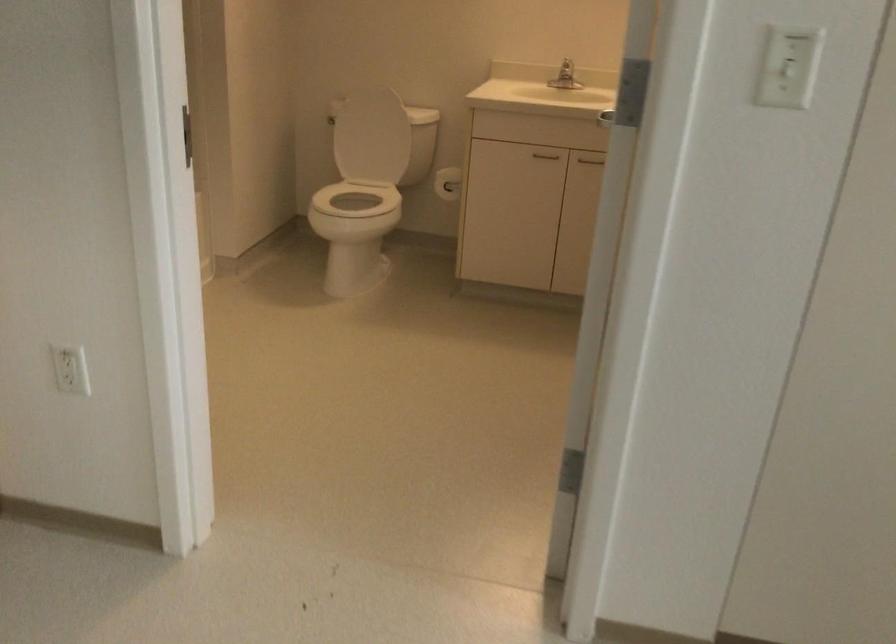
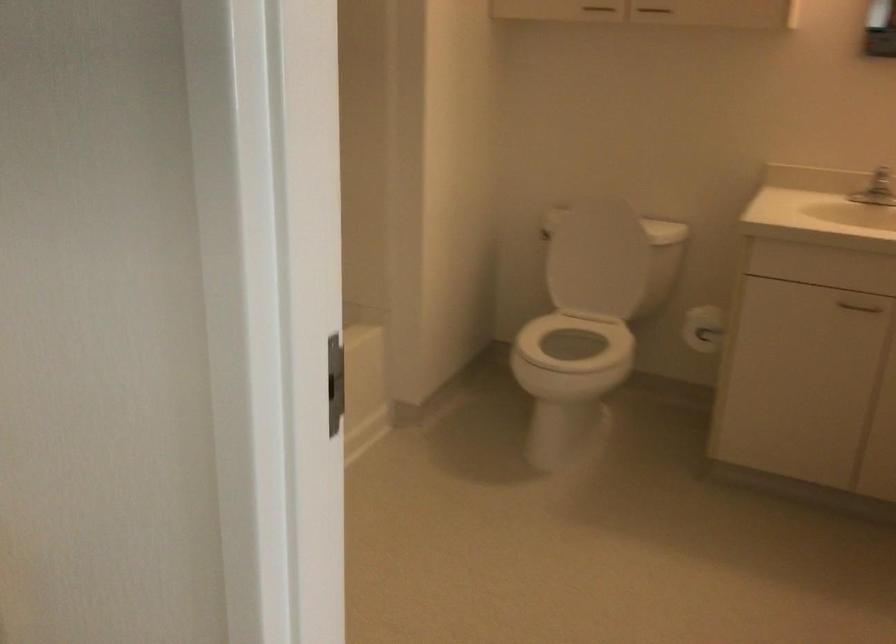
Where in the second image is the point corresponding to [571,69] from the first image?

(881, 182)